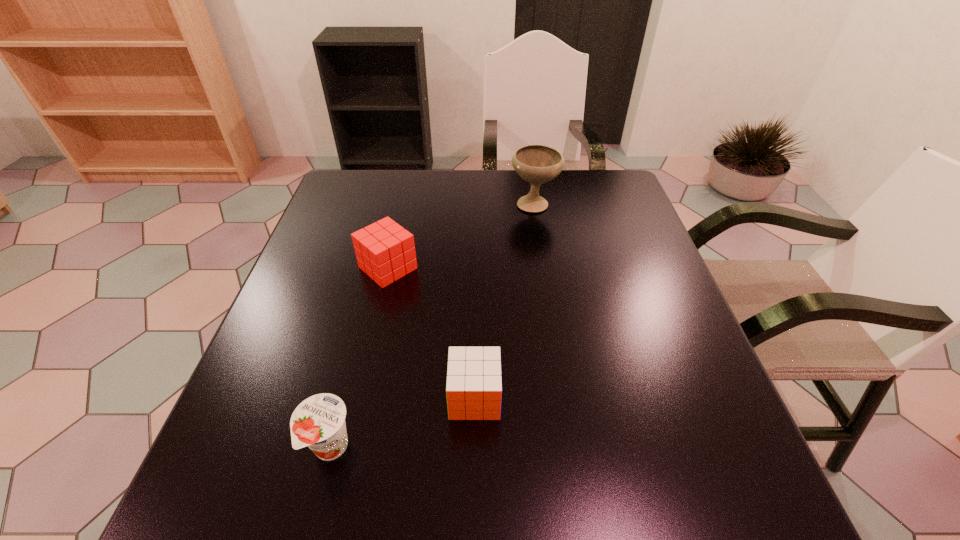
You are a GUI agent. You are given a task and a screenshot of the screen. Output one action in this format:
    pyautogui.click(x=<x>, y=<y>)
    Task: Click on the vacant space located on the right of the yogurt
    Image resolution: width=960 pixels, height=540 pixels.
    Given the screenshot: What is the action you would take?
    pyautogui.click(x=397, y=448)

Find the location of a particular element. This screenshot has height=540, width=960. object positioned at the far edge is located at coordinates (537, 164).

Locate an element on the screen. object that is at the near edge is located at coordinates (318, 422).

You are a GUI agent. You are given a task and a screenshot of the screen. Output one action in this format:
    pyautogui.click(x=<x>, y=<y>)
    Task: Click on the cube at the left edge
    This screenshot has width=960, height=540.
    Given the screenshot: What is the action you would take?
    pyautogui.click(x=385, y=251)

I want to click on yogurt positioned at the left edge, so click(318, 422).

Where is `object present at the near left corner`? object present at the near left corner is located at coordinates (318, 422).

The image size is (960, 540). In the image, there is a desktop. Find the location of `vacant region at the far edge`. vacant region at the far edge is located at coordinates (476, 191).

Identify the location of free spot at the near edge of the desktop. (511, 511).

Where is `vacant region at the left edge of the desktop`? vacant region at the left edge of the desktop is located at coordinates (329, 366).

In the image, there is a desktop. Identify the location of free space at the right edge. The height and width of the screenshot is (540, 960). (620, 241).